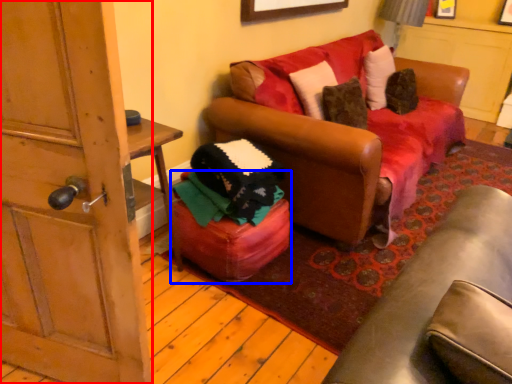
Question: Which object is further to the camera taking this photo, door (highlighted by a red box) or stool (highlighted by a blue box)?

Choices:
 (A) door
 (B) stool

Answer: (B)